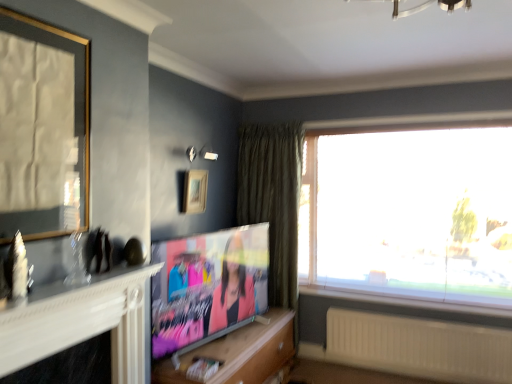
Question: Does wooden picture frame at upper center, marked as the first picture frame in a back-to-front arrangement, have a greater height compared to white ribbed radiator at lower right?

Choices:
 (A) no
 (B) yes

Answer: (A)

Question: Could white ribbed radiator at lower right be considered to be inside wooden picture frame at upper center, which is the 2th picture frame in left-to-right order?

Choices:
 (A) yes
 (B) no

Answer: (B)

Question: Does wooden picture frame at upper center, the 2th picture frame positioned from the front, have a greater width compared to white ribbed radiator at lower right?

Choices:
 (A) yes
 (B) no

Answer: (B)

Question: From a real-world perspective, is wooden picture frame at upper center, marked as the first picture frame in a back-to-front arrangement, positioned over white ribbed radiator at lower right based on gravity?

Choices:
 (A) yes
 (B) no

Answer: (A)

Question: Is wooden picture frame at upper center, the 2th picture frame positioned from the front, bigger than white ribbed radiator at lower right?

Choices:
 (A) yes
 (B) no

Answer: (B)

Question: In the image, is matte black tv at center on the left side or the right side of matte paper magazine at lower center?

Choices:
 (A) left
 (B) right

Answer: (B)

Question: Is point (164, 306) closer or farther from the camera than point (194, 380)?

Choices:
 (A) farther
 (B) closer

Answer: (A)

Question: From the image's perspective, is matte black tv at center above or below matte paper magazine at lower center?

Choices:
 (A) below
 (B) above

Answer: (B)

Question: Is matte black tv at center wider or thinner than matte paper magazine at lower center?

Choices:
 (A) wide
 (B) thin

Answer: (B)

Question: From the image's perspective, is matte paper magazine at lower center above or below white ribbed radiator at lower right?

Choices:
 (A) below
 (B) above

Answer: (B)

Question: Looking at their shapes, would you say matte paper magazine at lower center is wider or thinner than white ribbed radiator at lower right?

Choices:
 (A) wide
 (B) thin

Answer: (A)

Question: Visually, is matte paper magazine at lower center positioned to the left or to the right of white ribbed radiator at lower right?

Choices:
 (A) right
 (B) left

Answer: (B)

Question: Looking at the image, does matte paper magazine at lower center seem bigger or smaller compared to white ribbed radiator at lower right?

Choices:
 (A) big
 (B) small

Answer: (B)

Question: Considering the positions of white glossy fireplace at left and green velvet curtain at center in the image, is white glossy fireplace at left taller or shorter than green velvet curtain at center?

Choices:
 (A) tall
 (B) short

Answer: (B)

Question: From a real-world perspective, is white glossy fireplace at left physically located above or below green velvet curtain at center?

Choices:
 (A) below
 (B) above

Answer: (B)